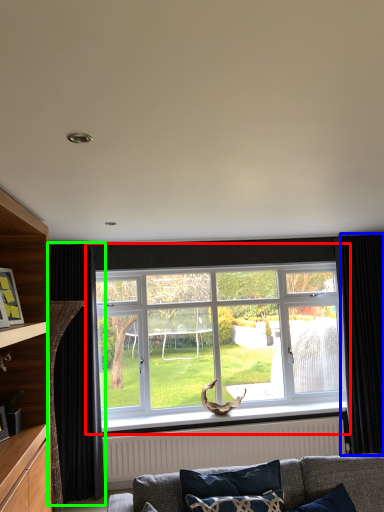
Question: Estimate the real-world distances between objects in this image. Which object is farther from window (highlighted by a red box), curtain (highlighted by a blue box) or curtain (highlighted by a green box)?

Choices:
 (A) curtain
 (B) curtain

Answer: (B)